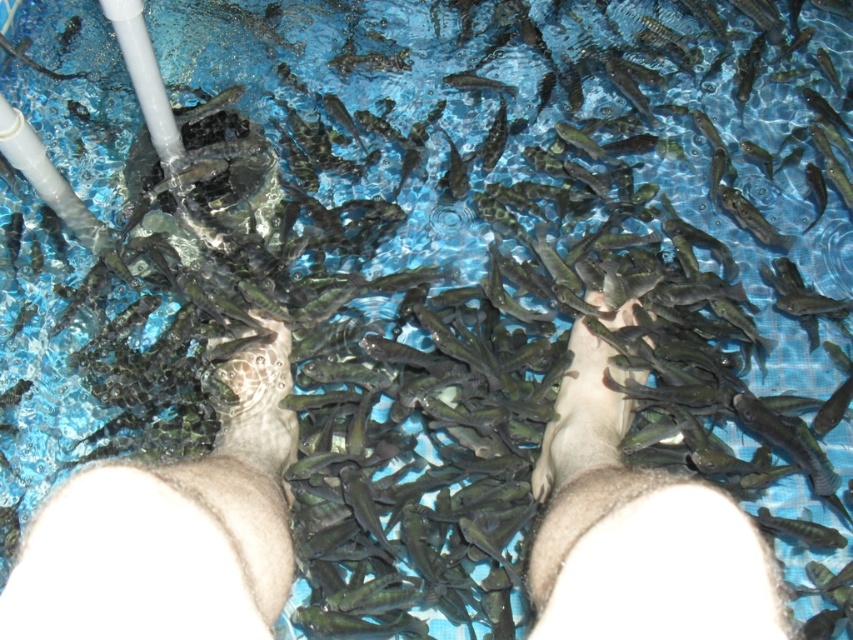
Question: Can you confirm if smooth skin feet at center is wider than smooth skin hand at center?

Choices:
 (A) no
 (B) yes

Answer: (A)

Question: Which of these objects is positioned closest to the smooth skin hand at center?

Choices:
 (A) brown leather foot at center
 (B) smooth skin feet at center

Answer: (A)

Question: Which object appears farthest from the camera in this image?

Choices:
 (A) brown leather foot at center
 (B) smooth skin hand at center
 (C) smooth skin feet at center

Answer: (A)

Question: Can you confirm if smooth skin feet at center is thinner than smooth skin hand at center?

Choices:
 (A) yes
 (B) no

Answer: (A)

Question: Which point is closer to the camera taking this photo?

Choices:
 (A) (595, 422)
 (B) (86, 545)

Answer: (B)

Question: Does smooth skin hand at center have a larger size compared to brown leather foot at center?

Choices:
 (A) yes
 (B) no

Answer: (A)